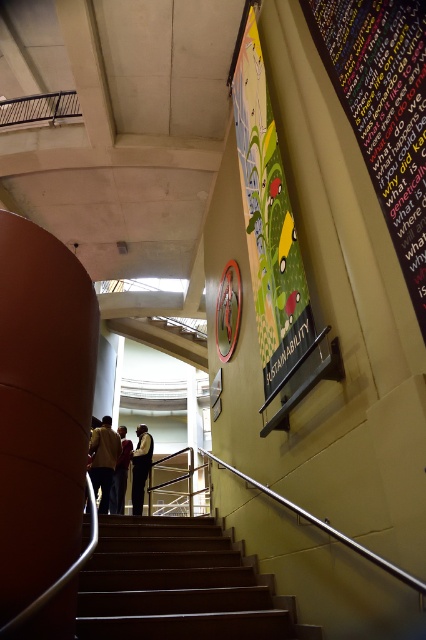
You are standing at the bottom of the staircase and notice both the vibrant glossy poster at upper center and the dark blue shirt at center. Which object is positioned more to the right from your viewpoint?

The vibrant glossy poster at upper center is positioned to the right of the dark blue shirt at center, so it is more to the right from your viewpoint.

You are a painter holding a 1.2 meter wide canvas. You want to hang it on the wall near the staircase. The vibrant glossy poster at upper center and the dark blue shirt at center are already there. Which object can your canvas fit next to without overlapping?

The vibrant glossy poster at upper center is larger in size than the dark blue shirt at center, so the canvas can fit next to the dark blue shirt at center since it is smaller and there might be enough space.